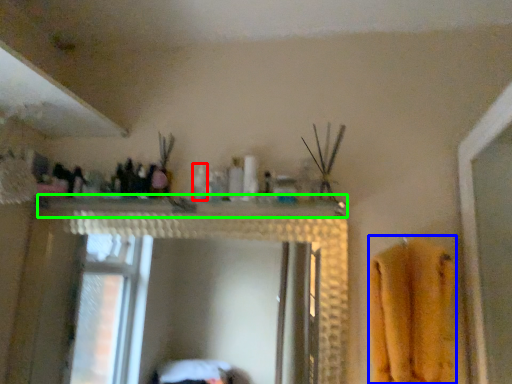
Question: Which object is positioned closest to toiletry (highlighted by a red box)? Select from bath towel (highlighted by a blue box) and counter top (highlighted by a green box).

Choices:
 (A) bath towel
 (B) counter top

Answer: (B)